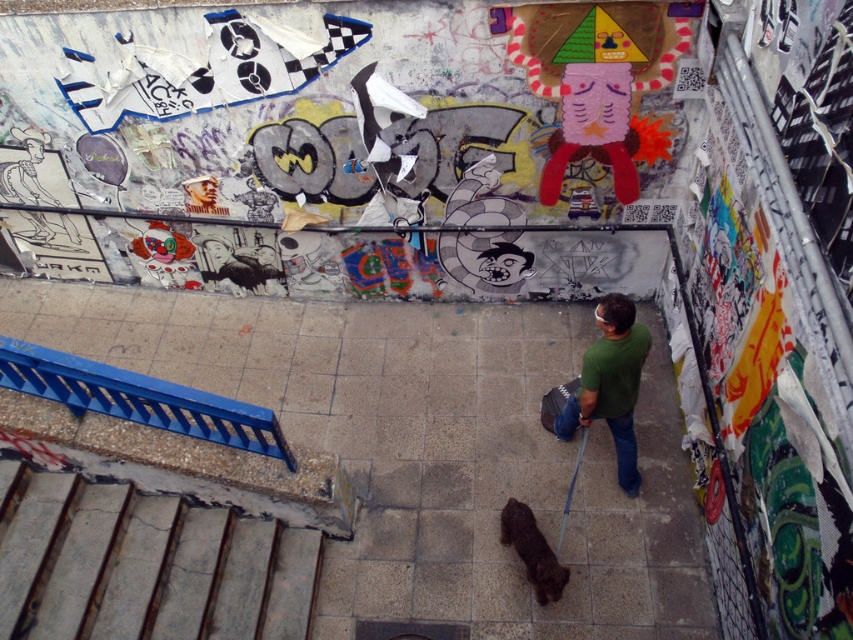
Question: Is shiny brown fur at center wider than blue fabric leash at lower center?

Choices:
 (A) yes
 (B) no

Answer: (A)

Question: Estimate the real-world distances between objects in this image. Which object is farther from the blue fabric leash at lower center?

Choices:
 (A) green matte shirt at center
 (B) shiny brown fur at center

Answer: (A)

Question: Can you confirm if green matte shirt at center is positioned to the left of shiny brown fur at center?

Choices:
 (A) no
 (B) yes

Answer: (A)

Question: Which point is farther to the camera?

Choices:
 (A) shiny brown fur at center
 (B) green matte shirt at center

Answer: (A)

Question: Which point appears closest to the camera in this image?

Choices:
 (A) (631, 467)
 (B) (550, 579)

Answer: (B)

Question: Can you confirm if green matte shirt at center is bigger than shiny brown fur at center?

Choices:
 (A) no
 (B) yes

Answer: (B)